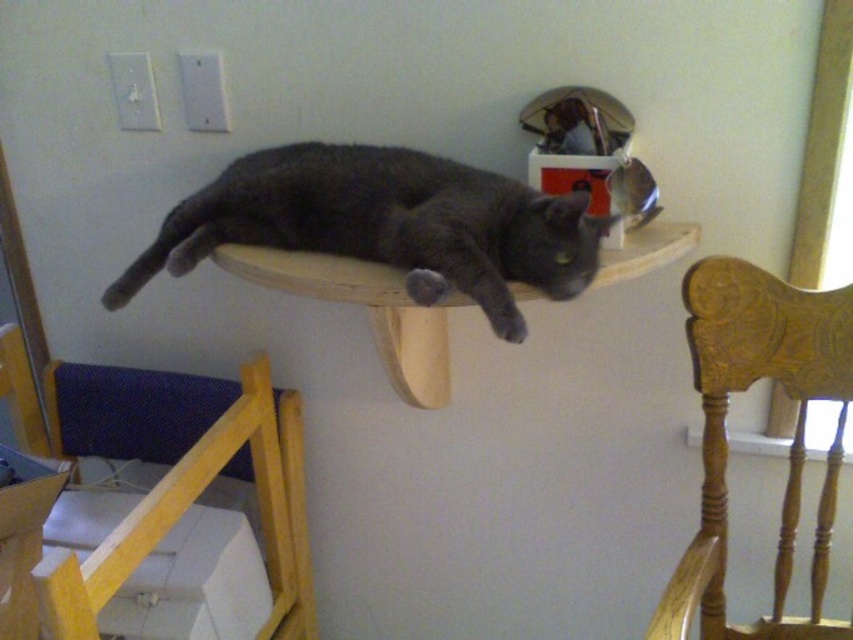
Is point (132, 269) farther from camera compared to point (682, 292)?

Yes.

Between dark gray fur cat at center and wooden carved chair at right, which one appears on the right side from the viewer's perspective?

Positioned to the right is wooden carved chair at right.

Locate an element on the screen. dark gray fur cat at center is located at coordinates (386, 225).

Who is positioned more to the left, wooden at left or dark gray fur cat at center?

From the viewer's perspective, wooden at left appears more on the left side.

From the picture: Who is more distant from viewer, (57, 392) or (320, 147)?

The point (57, 392) is behind.

Locate an element on the screen. The width and height of the screenshot is (853, 640). wooden at left is located at coordinates (154, 508).

Which is more to the right, wooden at left or wooden carved chair at right?

Positioned to the right is wooden carved chair at right.

Find the location of `wooden at left`. wooden at left is located at coordinates (154, 508).

Identify the location of wooden at left. (154, 508).

Identify the location of wooden at left. The width and height of the screenshot is (853, 640). (154, 508).